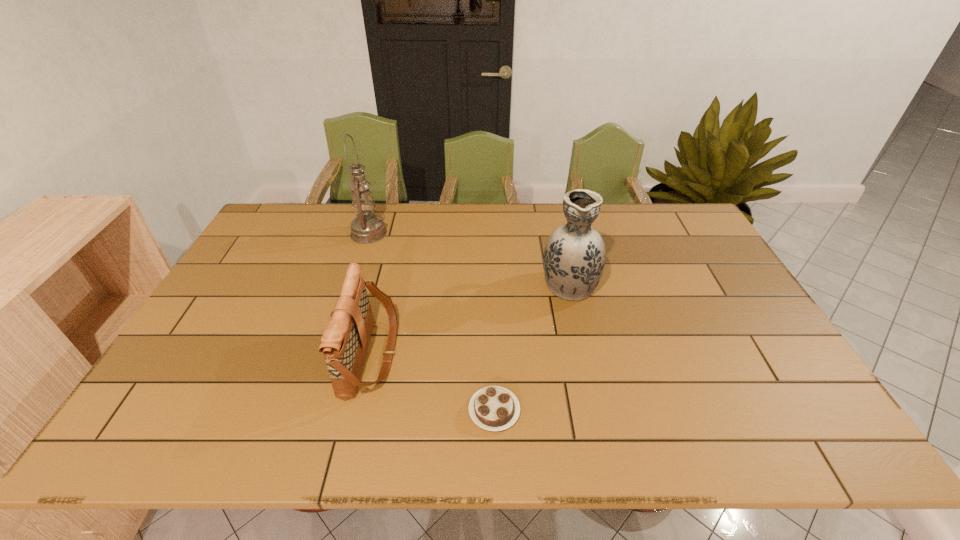
Image resolution: width=960 pixels, height=540 pixels. What are the coordinates of `the third closest object to the third tallest object` in the screenshot? It's located at (574, 257).

Identify which object is the third nearest to the shortest object. Please provide its 2D coordinates. Your answer should be formatted as a tuple, i.e. [(x, y)], where the tuple contains the x and y coordinates of a point satisfying the conditions above.

[(366, 228)]

In order to click on free spot that satisfies the following two spatial constraints: 1. on the front-facing side of the chocolate cake; 2. on the left side of the shoulder bag in this screenshot , I will do `click(358, 410)`.

You are a GUI agent. You are given a task and a screenshot of the screen. Output one action in this format:
    pyautogui.click(x=<x>, y=<y>)
    Task: Click on the free space that satisfies the following two spatial constraints: 1. on the front-facing side of the shoulder bag; 2. on the back side of the chocolate cake
    
    Given the screenshot: What is the action you would take?
    pyautogui.click(x=358, y=410)

The height and width of the screenshot is (540, 960). In order to click on vacant region that satisfies the following two spatial constraints: 1. on the front-facing side of the second shortest object; 2. on the right side of the chocolate cake in this screenshot , I will do `click(358, 410)`.

Where is `free space in the image that satisfies the following two spatial constraints: 1. on the front side of the oil lamp; 2. on the right side of the chocolate cake`? The image size is (960, 540). free space in the image that satisfies the following two spatial constraints: 1. on the front side of the oil lamp; 2. on the right side of the chocolate cake is located at coordinates (x=311, y=410).

You are a GUI agent. You are given a task and a screenshot of the screen. Output one action in this format:
    pyautogui.click(x=<x>, y=<y>)
    Task: Click on the vacant space that satisfies the following two spatial constraints: 1. on the back side of the chocolate cake; 2. on the front-facing side of the shoulder bag
    
    Given the screenshot: What is the action you would take?
    pyautogui.click(x=492, y=354)